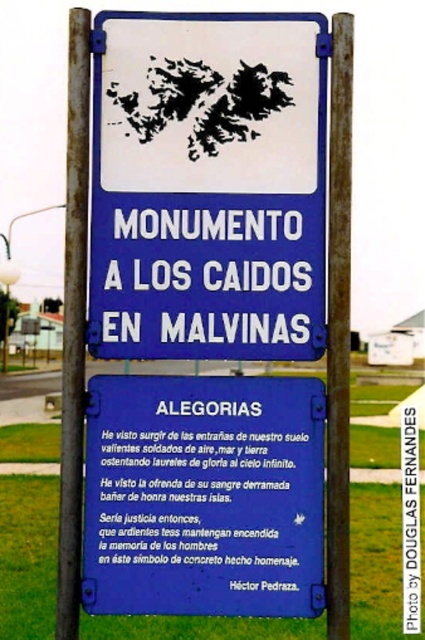
Please describe the location of the white plastic sign at center in terms of coordinates within the image frame. The coordinate system has the origin at the bottom left corner of the image, with x increasing to the right and y increasing upward. The maximum x and y values are both 1.0. Use the format x,y.

The white plastic sign at center is located at coordinates (207, 186) within the image frame.

You are a tourist standing in front of the monument and want to take a photo of the blue painted metal sign at center and the rusty metal pole at center. Which object should you position to your right side to capture both in the frame?

To capture both the blue painted metal sign at center and the rusty metal pole at center in the frame, position the rusty metal pole at center to your right side since the blue painted metal sign at center is to the left of the rusty metal pole at center.